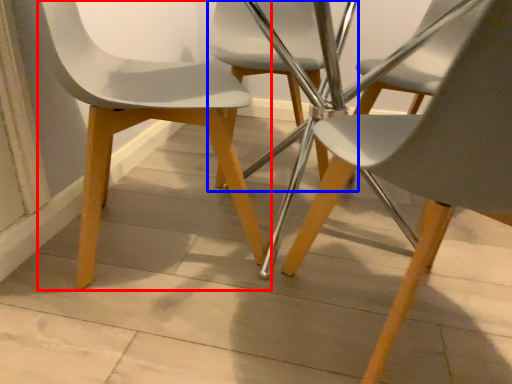
Question: Which object appears farthest to the camera in this image, chair (highlighted by a red box) or chair (highlighted by a blue box)?

Choices:
 (A) chair
 (B) chair

Answer: (B)